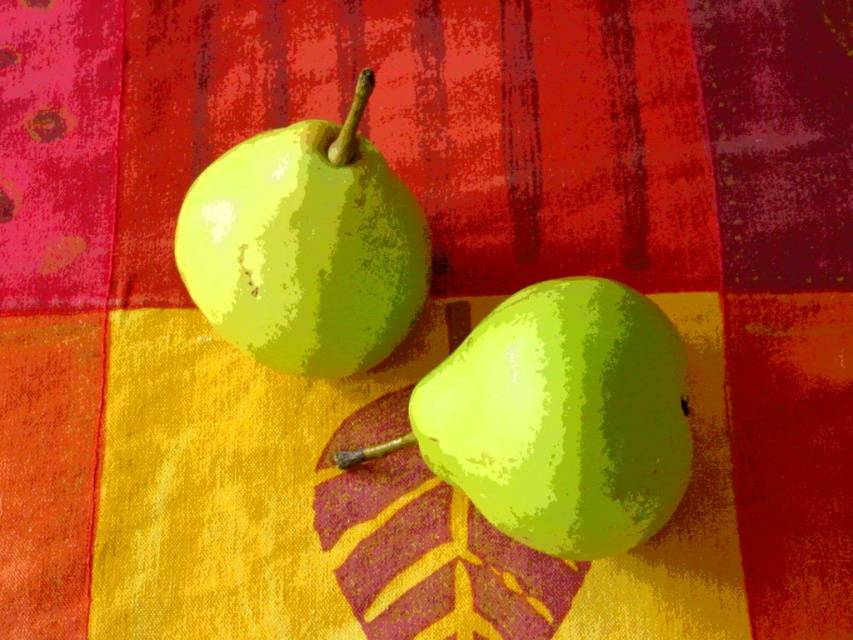
Where is the green matte pear at center located in the image?

The green matte pear at center is located at point (563, 417).

You are arranging fruits on a table and see the green matte pear at center and the green matte pear at upper left. Which pear is positioned to the right of the other?

The green matte pear at center is positioned to the right of the green matte pear at upper left.